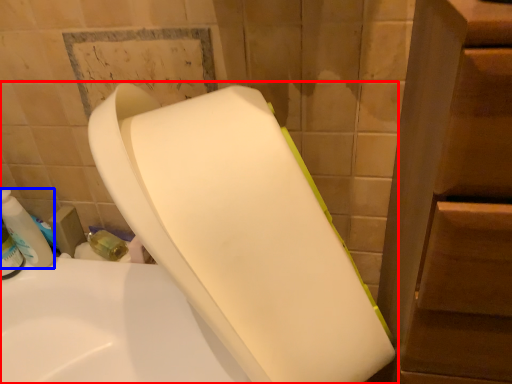
Question: Which object appears farthest to the camera in this image, toilet (highlighted by a red box) or cleaning product (highlighted by a blue box)?

Choices:
 (A) toilet
 (B) cleaning product

Answer: (B)